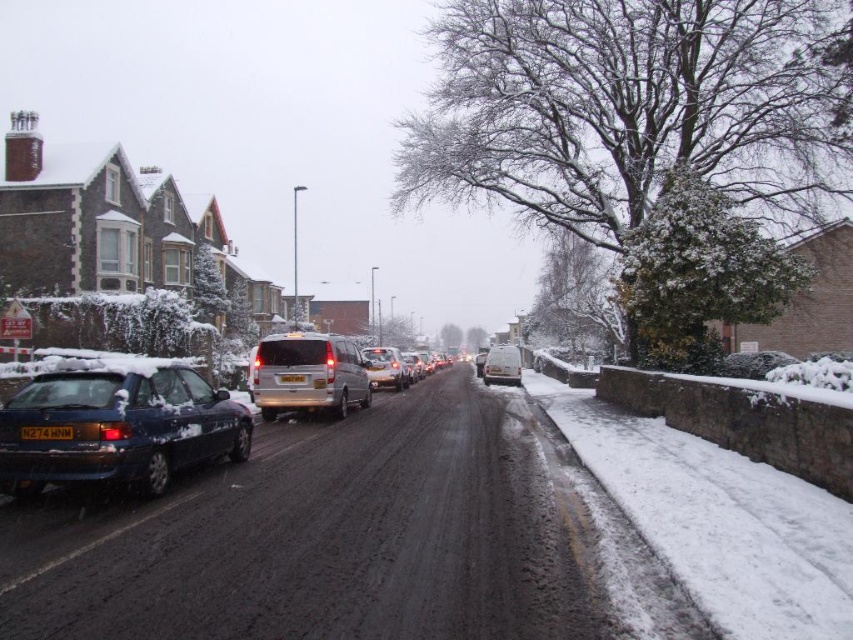
You are driving a delivery truck and need to pass through the snowy road where the silver metallic van at center and the white matte van at center are parked. Can you safely navigate around them without blocking the road?

The silver metallic van at center is in front of the white matte van at center, so you can safely navigate around them by driving around the silver metallic van at center first since it is closer to you, allowing you to pass through the road without obstruction.

You are a delivery driver who needs to park your vehicle in the area shown. You have a matte blue hatchback at left and a black plastic license plate at center in your view. Which vehicle part is higher in height between the two?

The matte blue hatchback at left is taller than the black plastic license plate at center, so the matte blue hatchback at left has a greater height.